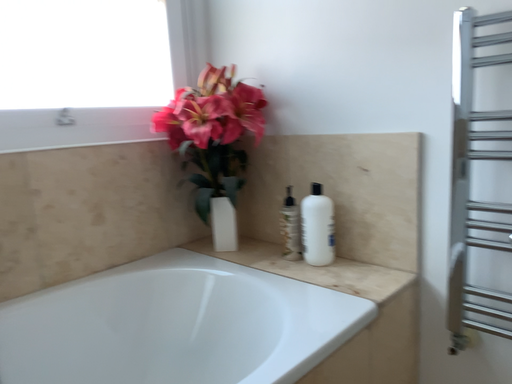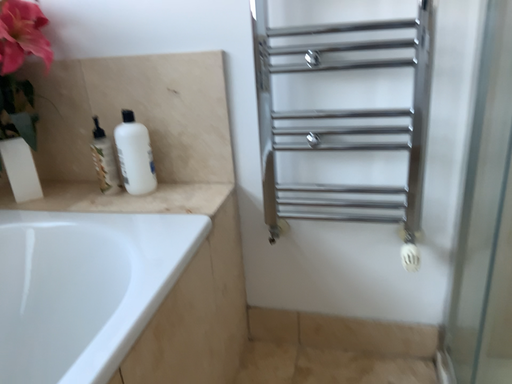
Question: Which way did the camera rotate in the video?

Choices:
 (A) rotated downward
 (B) rotated upward

Answer: (A)